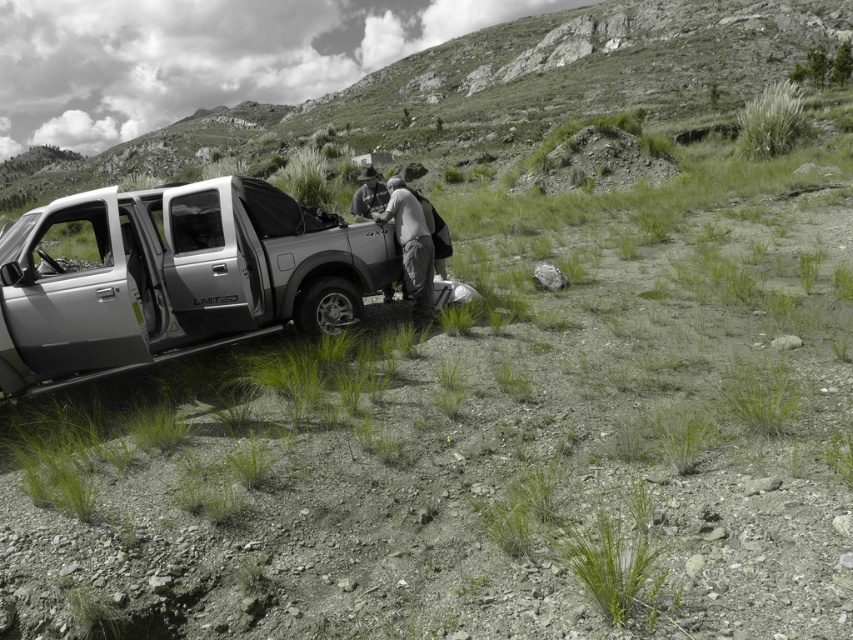
Does satin silver truck at left appear over gray fabric jacket at center?

Yes.

Is satin silver truck at left smaller than gray fabric jacket at center?

No, satin silver truck at left is not smaller than gray fabric jacket at center.

Who is more distant from viewer, [90,237] or [412,272]?

Point [90,237]

This screenshot has height=640, width=853. I want to click on satin silver truck at left, so click(173, 276).